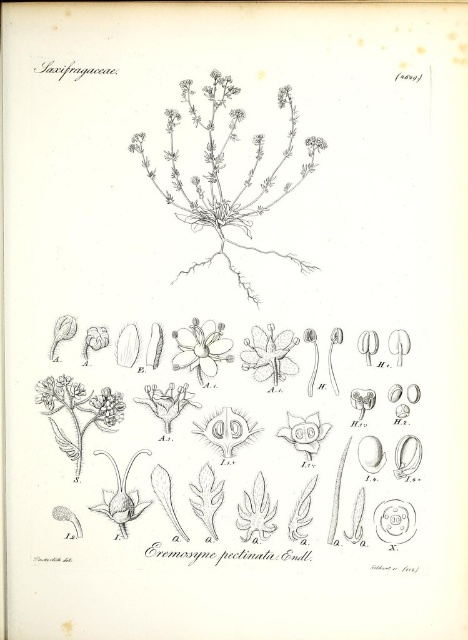
Does translucent white flower at center have a lesser height compared to white delicate flower at center?

No.

Does translucent white flower at center have a larger size compared to white delicate flower at center?

Yes.

Where is `translucent white flower at center`? The width and height of the screenshot is (468, 640). translucent white flower at center is located at coordinates (305, 433).

Who is lower down, smooth white flower at center or translucent white flower at center?

translucent white flower at center is lower down.

Which is more to the right, smooth white flower at center or translucent white flower at center?

From the viewer's perspective, translucent white flower at center appears more on the right side.

This screenshot has height=640, width=468. Describe the element at coordinates (269, 355) in the screenshot. I see `smooth white flower at center` at that location.

Find the location of a particular element. This screenshot has height=640, width=468. smooth white flower at center is located at coordinates 269,355.

Who is taller, white paper flower at center or smooth white flower at center?

white paper flower at center

Between point (181, 339) and point (286, 355), which one is positioned in front?

Point (286, 355)

What do you see at coordinates (200, 348) in the screenshot?
I see `white paper flower at center` at bounding box center [200, 348].

Locate an element on the screen. The image size is (468, 640). white paper flower at center is located at coordinates pyautogui.click(x=200, y=348).